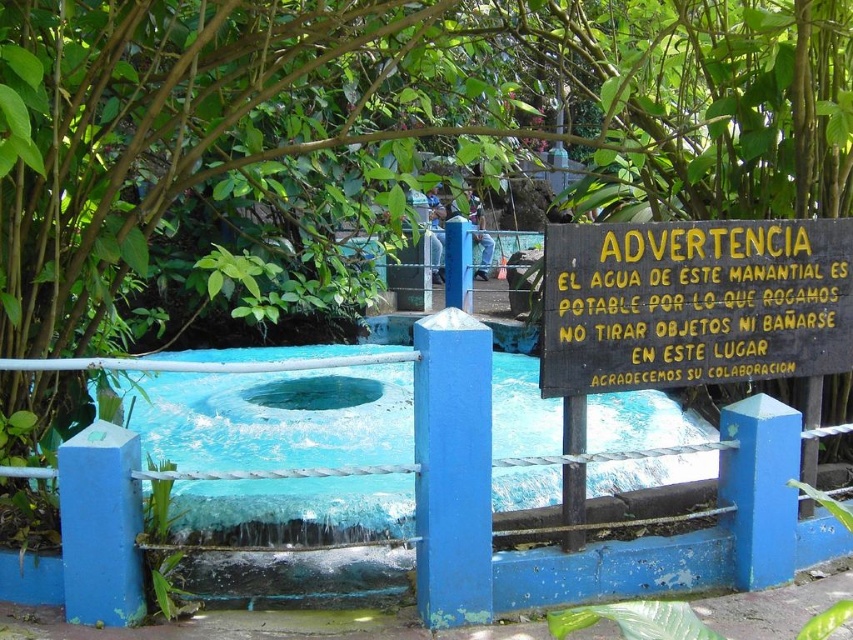
You are standing at the black wood sign at center and want to reach the blue concrete pool at center. Can you walk directly to the pool without stepping on any obstacles?

The distance between the blue concrete pool at center and the black wood sign at center is 3.71 meters. Since there are no obstacles mentioned in the scene description, you can walk directly to the pool.

You are standing at the edge of the blue concrete pool at center and want to read the black wood sign at center. Which direction should you turn to face the sign?

The black wood sign at center is behind the blue concrete pool at center, so you should turn around to face the sign.